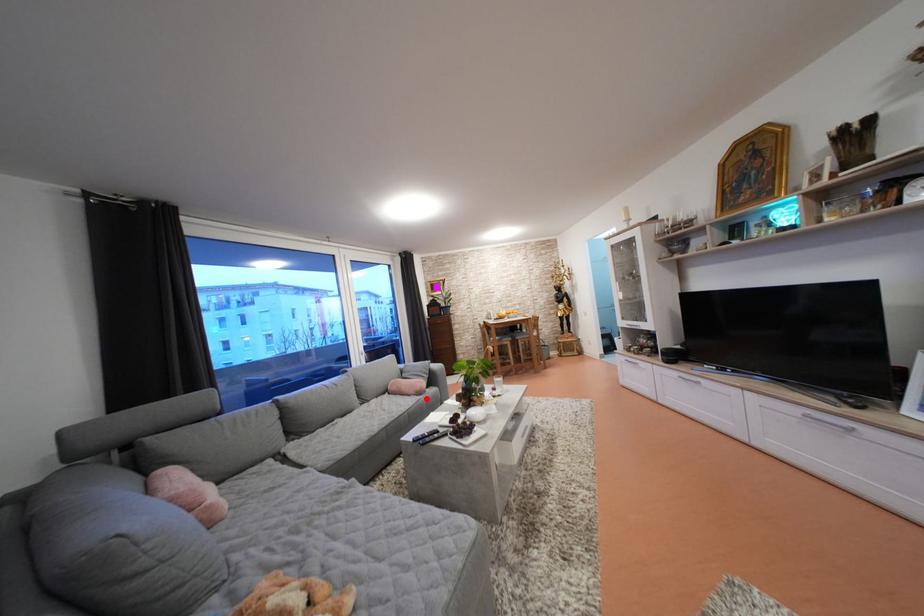
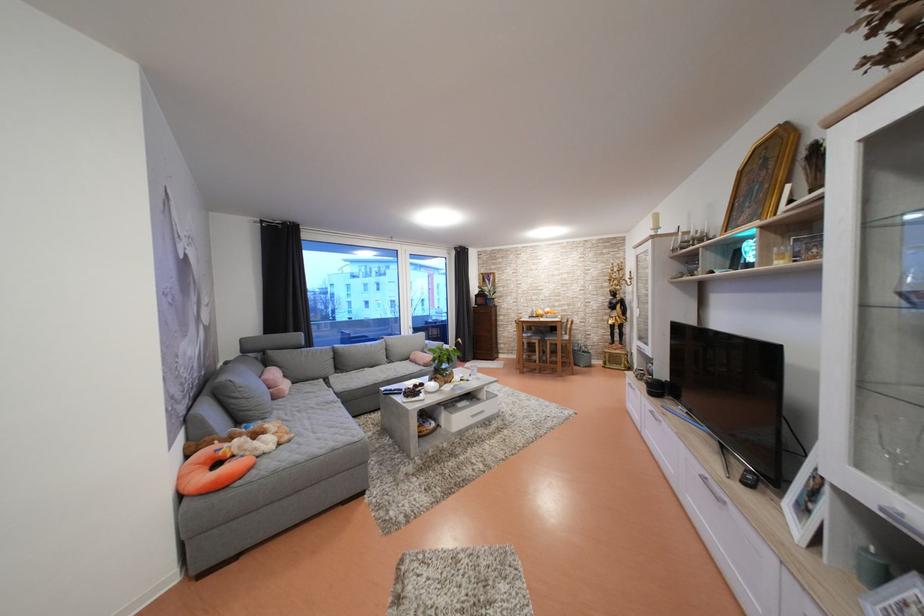
Question: I am providing you with two images of the same scene from different viewpoints. Image1 has a red point marked. In image2, the corresponding 3D location appears at what relative position? Reply with the corresponding letter.

Choices:
 (A) Closer
 (B) Farther

Answer: (B)